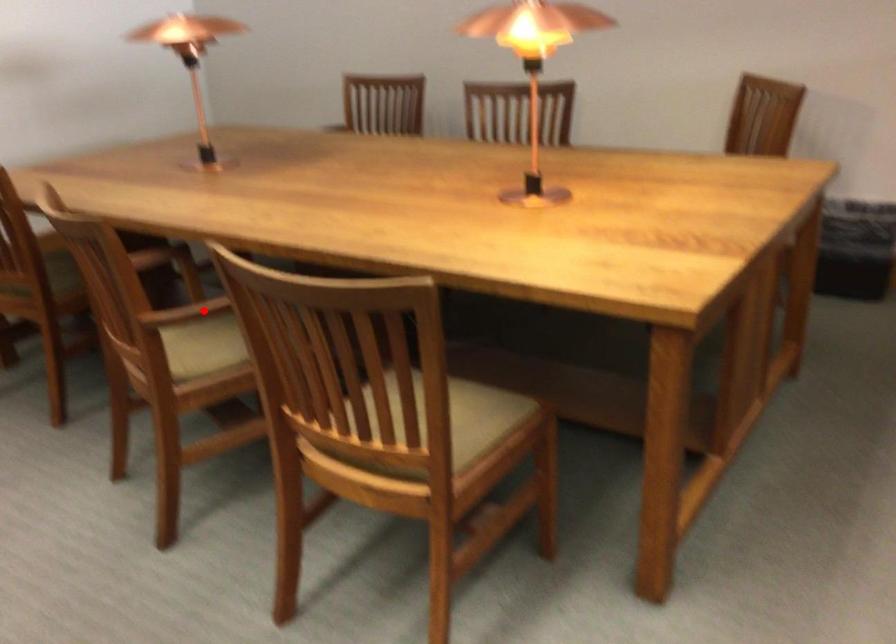
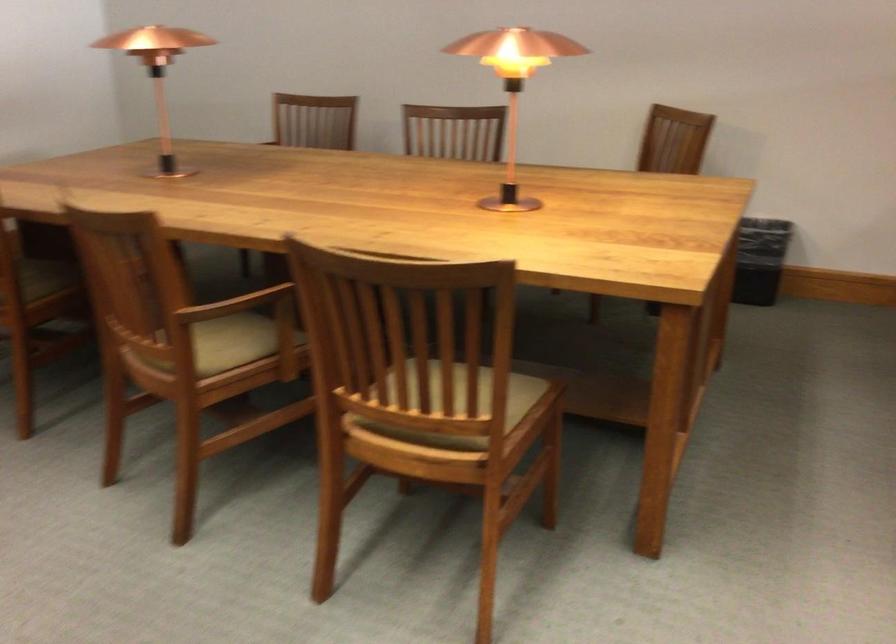
The point at the highlighted location is marked in the first image. Where is the corresponding point in the second image?

(236, 304)